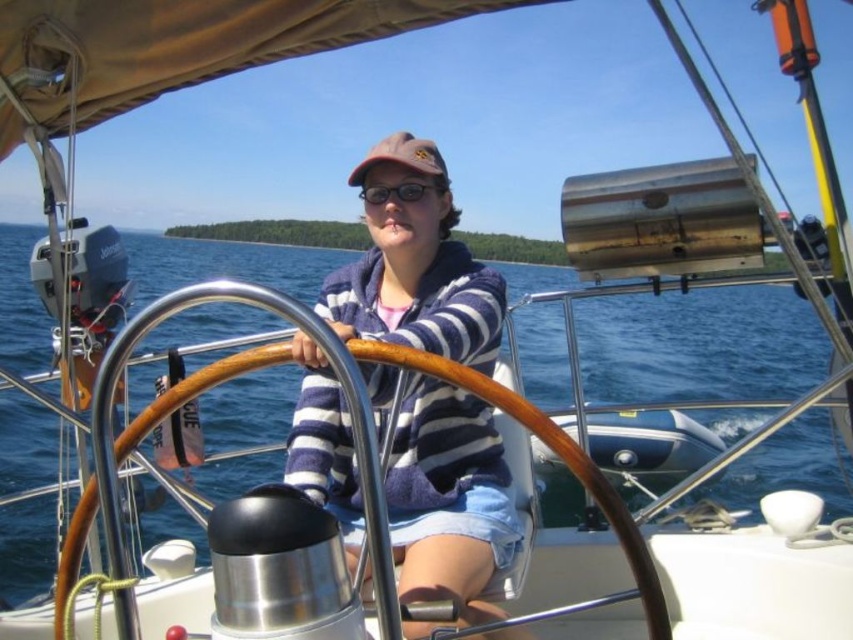
Question: Is striped cotton sweater at center thinner than wooden at center?

Choices:
 (A) no
 (B) yes

Answer: (B)

Question: Can you confirm if striped cotton sweater at center is thinner than transparent plastic goggles at center?

Choices:
 (A) no
 (B) yes

Answer: (A)

Question: Which point is farther to the camera?

Choices:
 (A) [299, 432]
 (B) [395, 193]
 (C) [67, 593]

Answer: (B)

Question: Which point is closer to the camera?

Choices:
 (A) wooden at center
 (B) striped cotton sweater at center
 (C) transparent plastic goggles at center

Answer: (A)

Question: Which object is the farthest from the wooden at center?

Choices:
 (A) transparent plastic goggles at center
 (B) striped cotton sweater at center

Answer: (A)

Question: Is wooden at center wider than transparent plastic goggles at center?

Choices:
 (A) no
 (B) yes

Answer: (B)